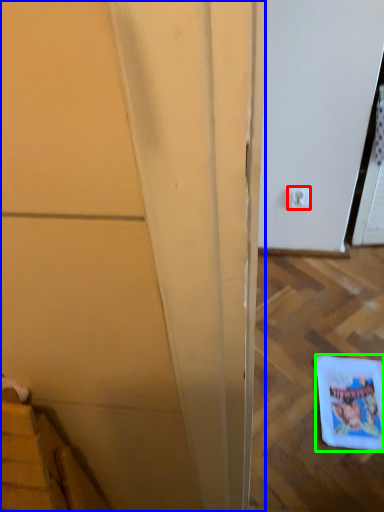
Question: Which is nearer to the electric outlet (highlighted by a red box)? door (highlighted by a blue box) or comic book (highlighted by a green box).

Choices:
 (A) door
 (B) comic book

Answer: (B)